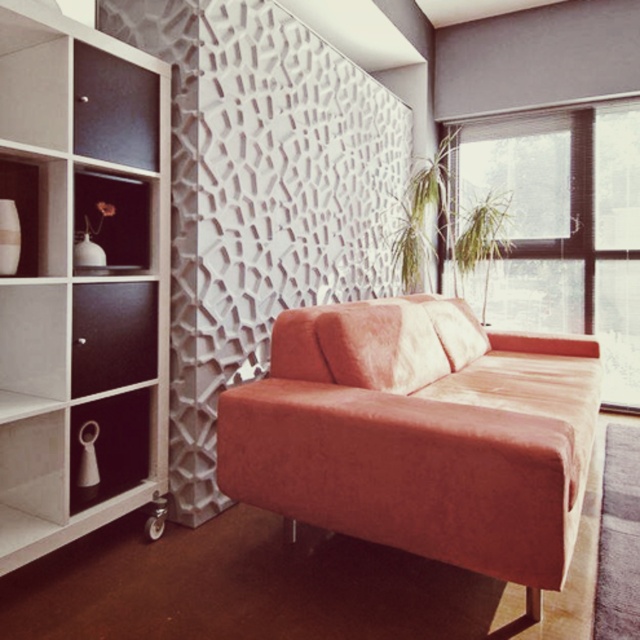
You are arranging a party in the living room and need to place a large centerpiece on the table. The velvet orange couch at center and the white glossy vase at left are in your way. Which object should you move to make space?

The velvet orange couch at center is located above the white glossy vase at left, so you should move the velvet orange couch at center to make space since it is positioned higher and might be blocking the table area.

You are a houseplant that needs direct sunlight. You are currently placed on the velvet orange couch at center. Which direction should you move to reach the sunlight coming through the transparent glass window at upper right?

The velvet orange couch at center is located below the transparent glass window at upper right, so the sunlight is coming from the upper right direction. To reach the sunlight, the houseplant should move towards the upper right direction from the velvet orange couch at center.

Consider the image. You are an interior designer planning to place a floor lamp that is 2 meters tall in the living room. Considering the white glossy bookshelf at left and the velvet orange couch at center, which object would you place the lamp next to so it doesn t block the view of the other object? Please explain your reasoning.

The white glossy bookshelf at left is taller than the velvet orange couch at center. To avoid blocking the view of the couch, the floor lamp should be placed next to the white glossy bookshelf at left because its greater height can help obscure the lamp, keeping the velvet orange couch at center visible.